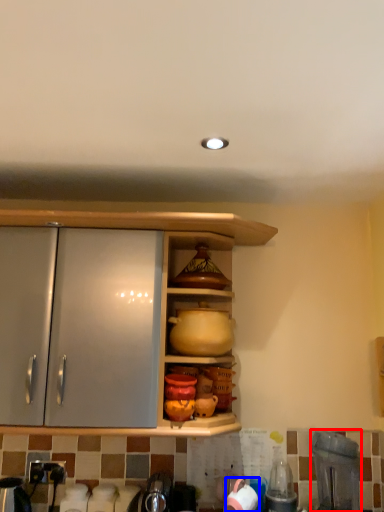
Question: Which point is closer to the camera, appliance (highlighted by a red box) or tableware (highlighted by a blue box)?

Choices:
 (A) appliance
 (B) tableware

Answer: (A)